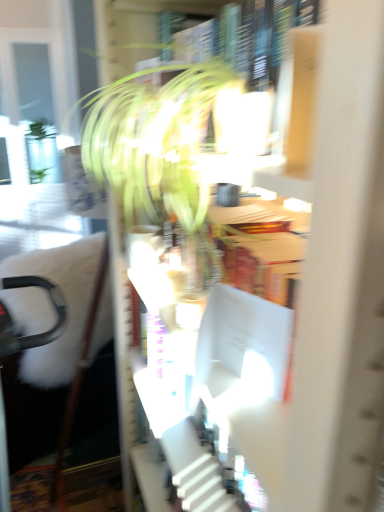
Question: Can you confirm if white cardboard bookcase at center is positioned to the right of green leafy plant at center?

Choices:
 (A) yes
 (B) no

Answer: (A)

Question: Is white cardboard bookcase at center further to the viewer compared to green leafy plant at center?

Choices:
 (A) no
 (B) yes

Answer: (A)

Question: Does white cardboard bookcase at center have a lesser height compared to green leafy plant at center?

Choices:
 (A) no
 (B) yes

Answer: (B)

Question: Is white cardboard bookcase at center bigger than green leafy plant at center?

Choices:
 (A) yes
 (B) no

Answer: (B)

Question: Does white cardboard bookcase at center come in front of green leafy plant at center?

Choices:
 (A) yes
 (B) no

Answer: (A)

Question: Does point (182, 118) appear closer or farther from the camera than point (274, 480)?

Choices:
 (A) closer
 (B) farther

Answer: (B)

Question: Looking at their shapes, would you say green leafy plant at center is wider or thinner than white cardboard bookcase at center?

Choices:
 (A) thin
 (B) wide

Answer: (B)

Question: From the image's perspective, relative to white cardboard bookcase at center, is green leafy plant at center above or below?

Choices:
 (A) above
 (B) below

Answer: (A)

Question: From their relative heights in the image, would you say green leafy plant at center is taller or shorter than white cardboard bookcase at center?

Choices:
 (A) short
 (B) tall

Answer: (B)

Question: From a real-world perspective, is white cardboard bookcase at center positioned above or below green leafy plant at center?

Choices:
 (A) above
 (B) below

Answer: (B)

Question: Is white cardboard bookcase at center taller or shorter than green leafy plant at center?

Choices:
 (A) tall
 (B) short

Answer: (B)

Question: Which is correct: white cardboard bookcase at center is inside green leafy plant at center, or outside of it?

Choices:
 (A) outside
 (B) inside

Answer: (A)

Question: Relative to green leafy plant at center, is white cardboard bookcase at center in front or behind?

Choices:
 (A) front
 (B) behind

Answer: (A)

Question: Is black plastic swivel chair at left in front of or behind white cardboard bookcase at center in the image?

Choices:
 (A) behind
 (B) front

Answer: (A)

Question: Considering the positions of black plastic swivel chair at left and white cardboard bookcase at center in the image, is black plastic swivel chair at left wider or thinner than white cardboard bookcase at center?

Choices:
 (A) thin
 (B) wide

Answer: (B)